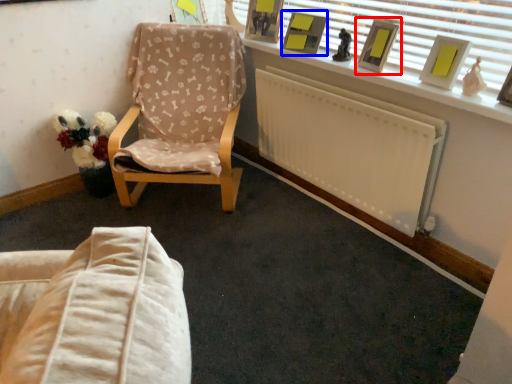
Question: Which object is further to the camera taking this photo, picture frame (highlighted by a red box) or picture frame (highlighted by a blue box)?

Choices:
 (A) picture frame
 (B) picture frame

Answer: (B)